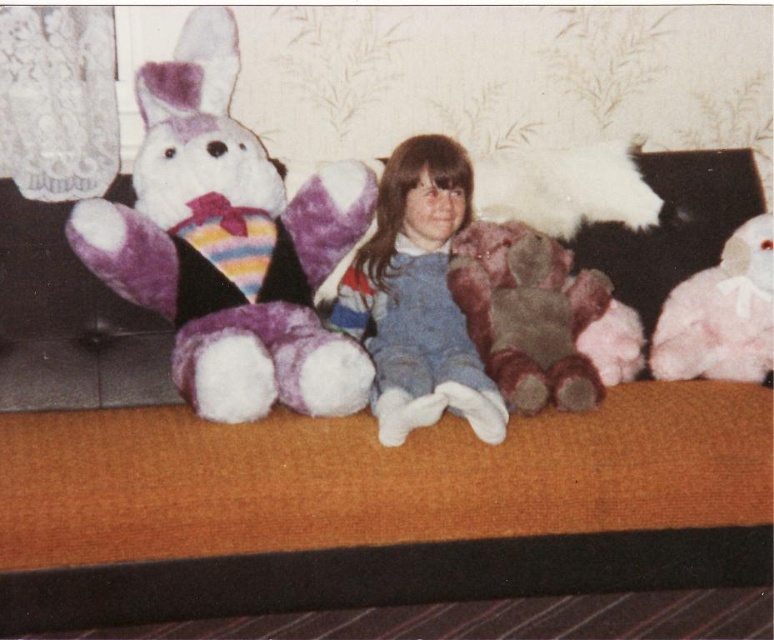
Question: Which of these objects is positioned closest to the fluffy pink teddy bear at right?

Choices:
 (A) fuzzy brown teddy bear at center
 (B) purple plush bunny at left

Answer: (A)

Question: Does purple plush bunny at left have a greater width compared to blue denim overalls at center?

Choices:
 (A) yes
 (B) no

Answer: (A)

Question: Can you confirm if purple plush bunny at left is positioned above blue denim overalls at center?

Choices:
 (A) no
 (B) yes

Answer: (B)

Question: Among these points, which one is nearest to the camera?

Choices:
 (A) (478, 358)
 (B) (204, 394)

Answer: (B)

Question: Can you confirm if purple plush bunny at left is smaller than blue denim overalls at center?

Choices:
 (A) yes
 (B) no

Answer: (B)

Question: Which of the following is the closest to the observer?

Choices:
 (A) fluffy pink teddy bear at right
 (B) blue denim overalls at center
 (C) purple plush bunny at left
 (D) fuzzy brown teddy bear at center

Answer: (B)